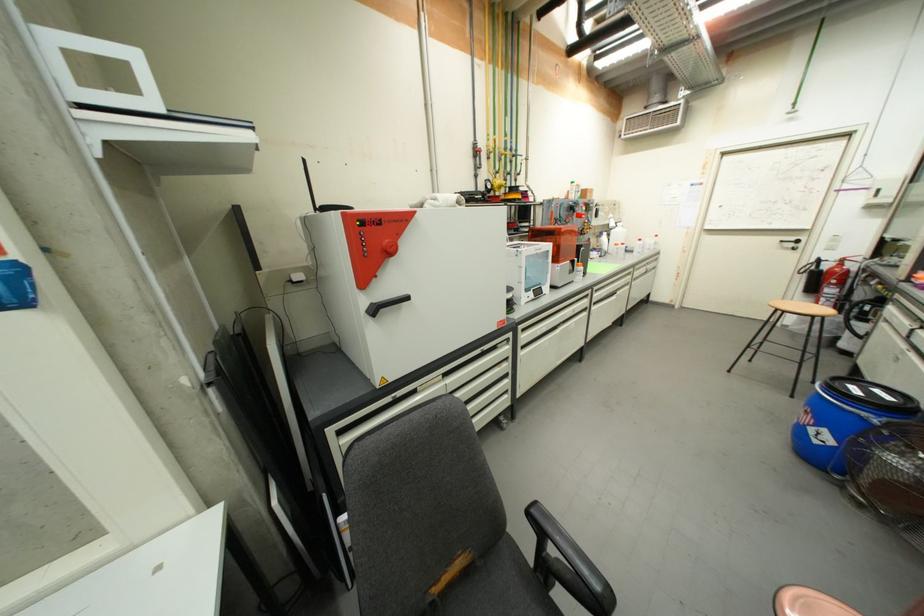
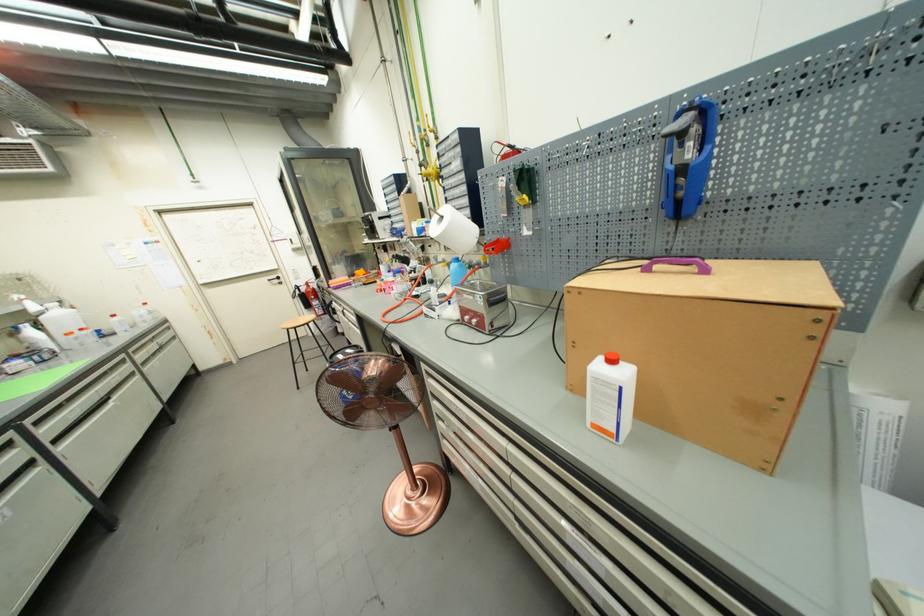
Locate, in the second image, the point that corresponds to [599,302] in the first image.

(52, 440)